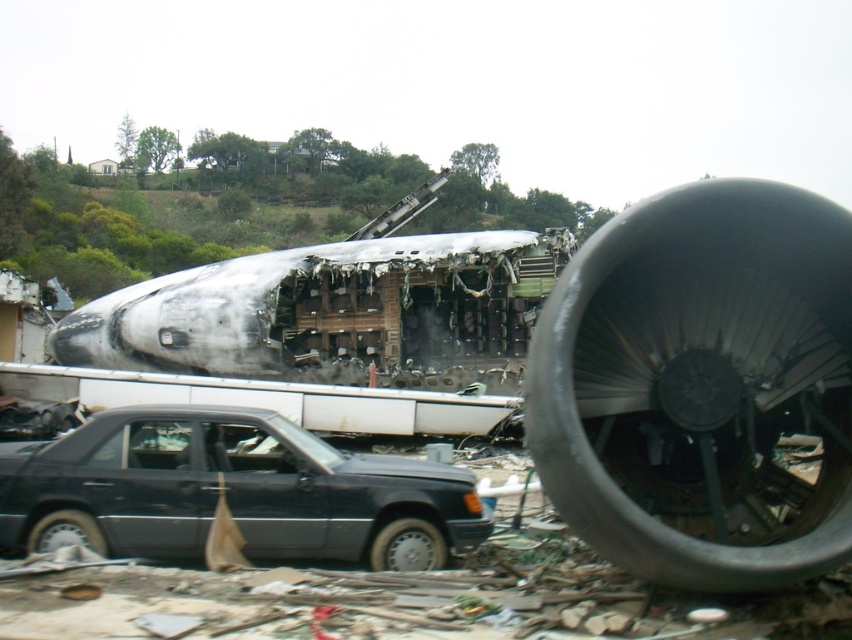
You are a rescue worker assessing the crash site. You see the silver metallic tire at lower center and the black rubber tire at lower left. Which tire is larger in size?

The silver metallic tire at lower center is bigger than the black rubber tire at lower left according to the description.

You are a rescue worker assessing the crash site. You need to determine if the matte black sedan at lower left can safely carry the silver metallic tire at lower center to a secure location. Based on their sizes, is this feasible?

The matte black sedan at lower left is larger than the silver metallic tire at lower center, so it is feasible for the sedan to safely carry the tire to a secure location.